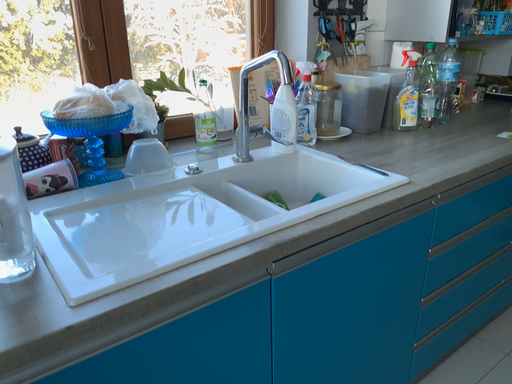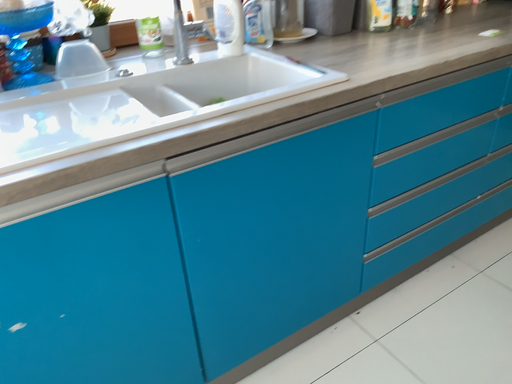
Question: Which way did the camera rotate in the video?

Choices:
 (A) rotated downward
 (B) rotated upward

Answer: (A)